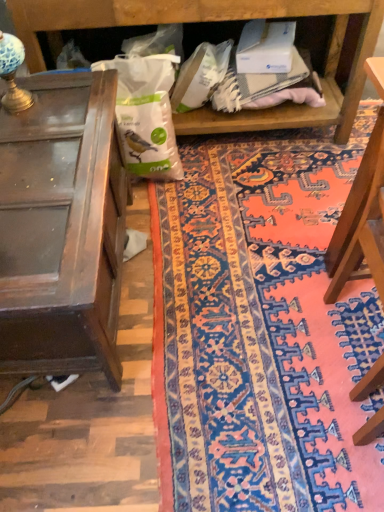
Locate an element on the screen. vacant space to the right of white matte paper bag at center is located at coordinates (217, 172).